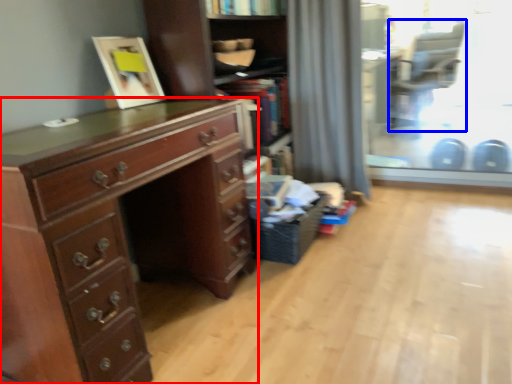
Question: Which of the following is the farthest to the observer, chest of drawers (highlighted by a red box) or armchair (highlighted by a blue box)?

Choices:
 (A) chest of drawers
 (B) armchair

Answer: (B)